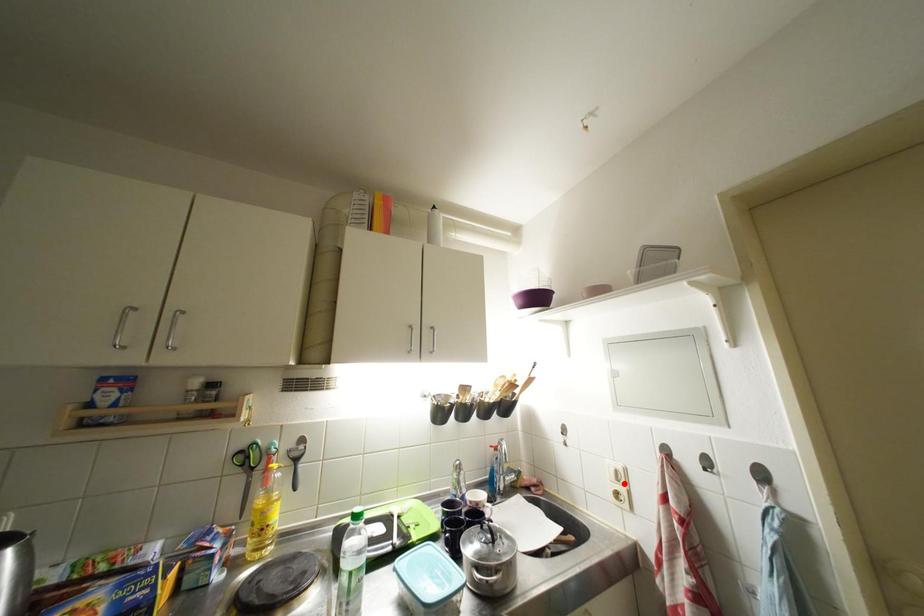
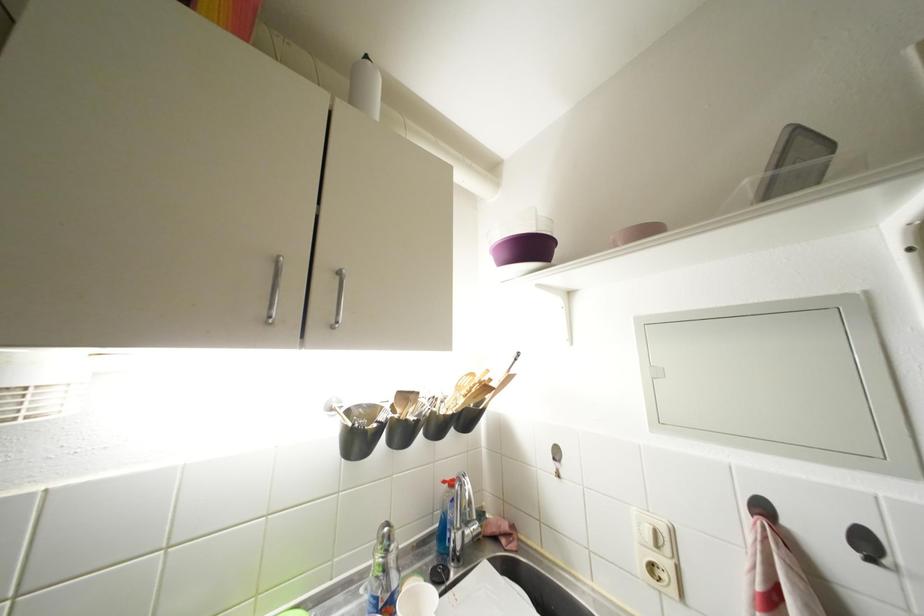
Find the pixel in the second image that matches the highlighted location in the first image.

(663, 549)